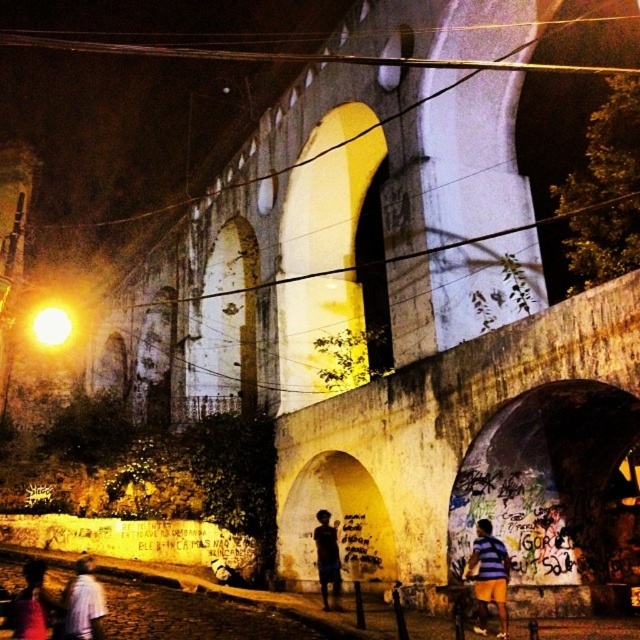
Question: Does white cotton shirt at lower left lie behind matte pink shirt at lower left?

Choices:
 (A) yes
 (B) no

Answer: (A)

Question: Which object is farther from the camera taking this photo?

Choices:
 (A) white cotton shirt at lower left
 (B) dark skin textured shirt at center
 (C) matte pink shirt at lower left
 (D) yellow concrete wall at center

Answer: (B)

Question: Among these objects, which one is nearest to the camera?

Choices:
 (A) matte pink shirt at lower left
 (B) striped shirt at lower right
 (C) white cotton shirt at lower left

Answer: (A)

Question: Considering the relative positions of striped shirt at lower right and matte pink shirt at lower left in the image provided, where is striped shirt at lower right located with respect to matte pink shirt at lower left?

Choices:
 (A) left
 (B) right

Answer: (B)

Question: Is matte pink shirt at lower left further to the viewer compared to dark skin textured shirt at center?

Choices:
 (A) yes
 (B) no

Answer: (B)

Question: Among these points, which one is farthest from the camera?

Choices:
 (A) (35, 593)
 (B) (321, 545)

Answer: (B)